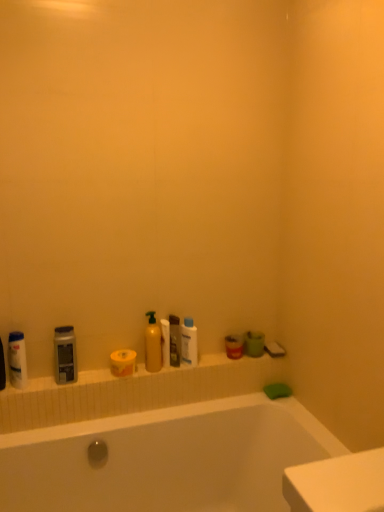
This screenshot has width=384, height=512. Identify the location of free space between white matte bottle at left, which ranks as the 2th mouthwash in right-to-left order, and matte gray bottle at left, which ranks as the third cleaning product in right-to-left order. (40, 385).